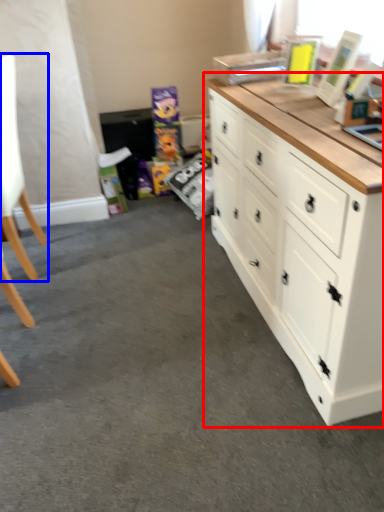
Question: Which object is further to the camera taking this photo, chest of drawers (highlighted by a red box) or swivel chair (highlighted by a blue box)?

Choices:
 (A) chest of drawers
 (B) swivel chair

Answer: (B)